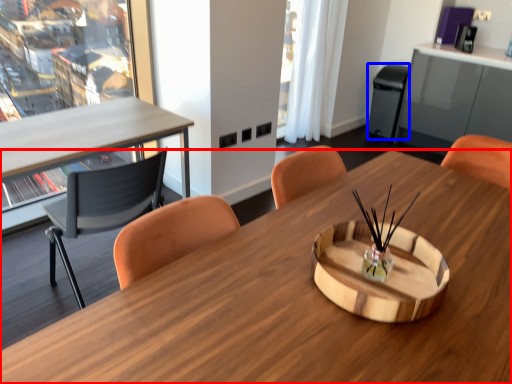
Question: Among these objects, which one is nearest to the camera, desk (highlighted by a red box) or trash bin/can (highlighted by a blue box)?

Choices:
 (A) desk
 (B) trash bin/can

Answer: (A)